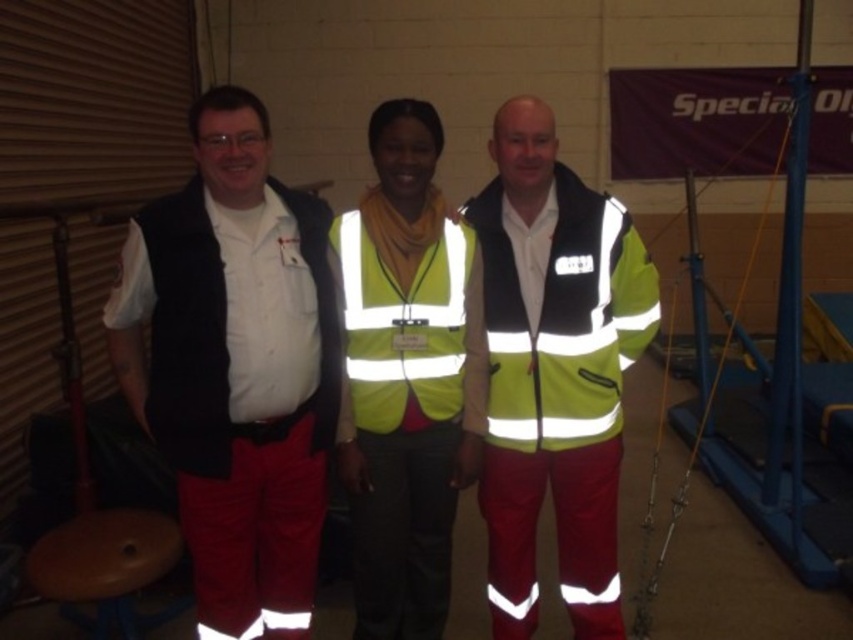
Question: Which of the following is the closest to the observer?

Choices:
 (A) (158, 262)
 (B) (125, 563)
 (C) (183, 372)

Answer: (A)

Question: Is yellow reflective vest at center to the left of yellow reflective safety vest at center from the viewer's perspective?

Choices:
 (A) yes
 (B) no

Answer: (B)

Question: Considering the relative positions of matte black vest at left and yellow reflective vest at center in the image provided, where is matte black vest at left located with respect to yellow reflective vest at center?

Choices:
 (A) left
 (B) right

Answer: (A)

Question: Considering the real-world distances, which object is farthest from the yellow reflective safety vest at center?

Choices:
 (A) black fabric vest at left
 (B) yellow reflective vest at center

Answer: (A)

Question: Which object is closer to the camera taking this photo?

Choices:
 (A) matte black vest at left
 (B) yellow reflective safety vest at center
 (C) wooden stool at lower left

Answer: (A)

Question: Where is yellow reflective vest at center located in relation to yellow reflective safety vest at center in the image?

Choices:
 (A) above
 (B) below

Answer: (B)